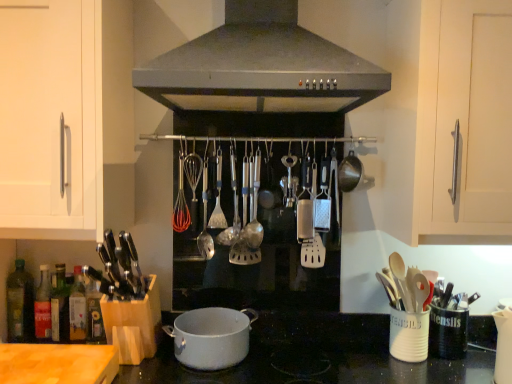
Question: Which direction should I rotate to face satin silver spoon at center, acting as the first utensil starting from the right, — up or down?

Choices:
 (A) down
 (B) up

Answer: (A)

Question: From the image's perspective, would you say white matte pot at center is shown under silver metallic spoon at center, which appears as the first utensil when viewed from the left?

Choices:
 (A) yes
 (B) no

Answer: (A)

Question: Could you tell me if white matte pot at center is turned towards silver metallic spoon at center, which appears as the first utensil when viewed from the left?

Choices:
 (A) yes
 (B) no

Answer: (B)

Question: Is white matte pot at center positioned behind silver metallic spoon at center, which appears as the first utensil when viewed from the left?

Choices:
 (A) yes
 (B) no

Answer: (B)

Question: Is white matte pot at center outside silver metallic spoon at center, the third utensil viewed from the right?

Choices:
 (A) no
 (B) yes

Answer: (B)

Question: From the image's perspective, is white matte pot at center above silver metallic spoon at center, the third utensil viewed from the right?

Choices:
 (A) yes
 (B) no

Answer: (B)

Question: Considering the relative positions of white matte pot at center and silver metallic spoon at center, which appears as the first utensil when viewed from the left, in the image provided, is white matte pot at center in front of silver metallic spoon at center, which appears as the first utensil when viewed from the left,?

Choices:
 (A) no
 (B) yes

Answer: (B)

Question: Can you confirm if wooden spoons at right is thinner than satin silver spoon at center, which appears as the 2th utensil when viewed from the right?

Choices:
 (A) yes
 (B) no

Answer: (B)

Question: Is wooden spoons at right behind satin silver spoon at center, which is the second utensil in left-to-right order?

Choices:
 (A) yes
 (B) no

Answer: (B)

Question: Does wooden spoons at right have a greater height compared to satin silver spoon at center, which is the second utensil in left-to-right order?

Choices:
 (A) no
 (B) yes

Answer: (A)

Question: Would you say wooden spoons at right is a long distance from satin silver spoon at center, which is the second utensil in left-to-right order?

Choices:
 (A) no
 (B) yes

Answer: (A)

Question: Considering the relative positions of wooden spoons at right and satin silver spoon at center, which appears as the 2th utensil when viewed from the right, in the image provided, is wooden spoons at right to the right of satin silver spoon at center, which appears as the 2th utensil when viewed from the right, from the viewer's perspective?

Choices:
 (A) yes
 (B) no

Answer: (A)

Question: Could you tell me if wooden spoons at right is facing satin silver spoon at center, which appears as the 2th utensil when viewed from the right?

Choices:
 (A) yes
 (B) no

Answer: (B)

Question: From a real-world perspective, is silver metallic spoon at center, the third utensil viewed from the right, over white ceramic utensil holder at lower right?

Choices:
 (A) yes
 (B) no

Answer: (A)